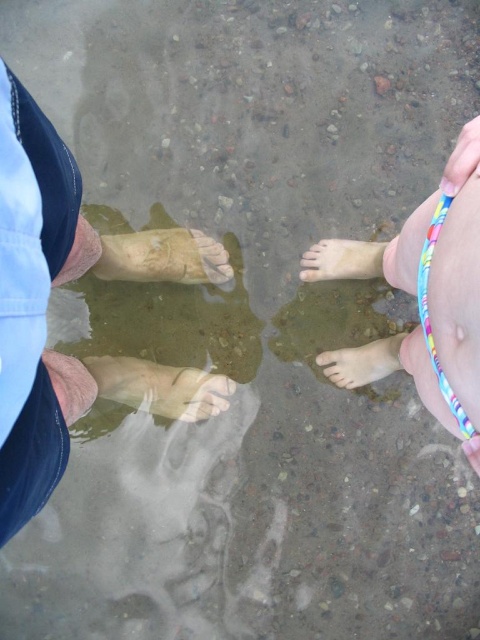
Question: Which of the following is the farthest from the observer?

Choices:
 (A) (364, 365)
 (B) (321, 356)
 (C) (36, 202)
 (D) (450, 177)

Answer: (B)

Question: Does pink smooth foot at lower center appear on the right side of smooth plastic toe at upper right?

Choices:
 (A) yes
 (B) no

Answer: (B)

Question: Which is nearer to the brown skin feet at left?

Choices:
 (A) pale skin foot at center
 (B) smooth skin feet at right

Answer: (B)

Question: Considering the real-world distances, which object is farthest from the yellow matte sand at center?

Choices:
 (A) smooth skin feet at right
 (B) brown skin feet at left
 (C) pale skin foot at lower center
 (D) pink smooth foot at lower center

Answer: (D)

Question: Observing the image, what is the correct spatial positioning of brown skin feet at left in reference to smooth skin toe at center?

Choices:
 (A) below
 (B) above

Answer: (B)

Question: Is smooth plastic toe at upper right wider than smooth skin toe at center?

Choices:
 (A) no
 (B) yes

Answer: (A)